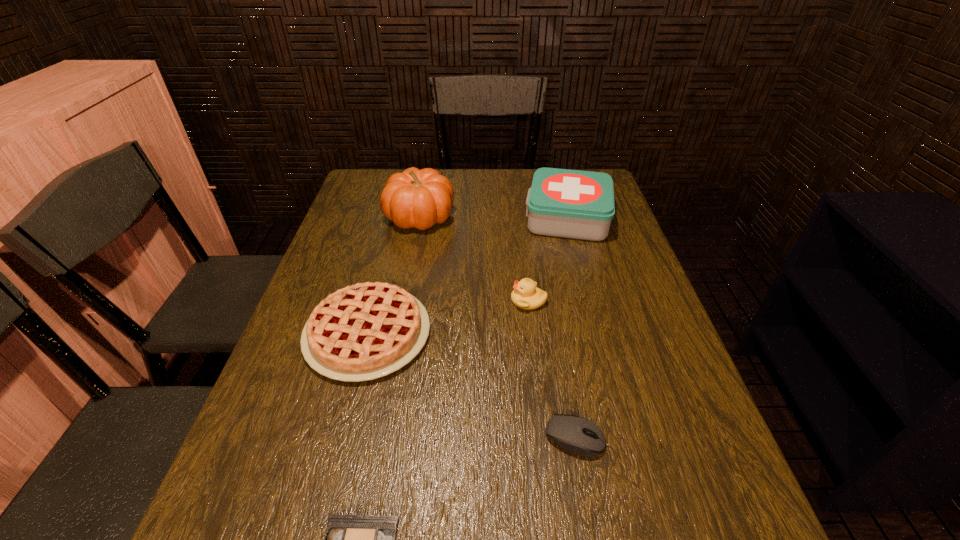
Find the location of `vacant area between the fourth shortest object and the third shortest object`. vacant area between the fourth shortest object and the third shortest object is located at coordinates (448, 317).

Select which object is the closest to the first-aid kit. Please provide its 2D coordinates. Your answer should be formatted as a tuple, i.e. [(x, y)], where the tuple contains the x and y coordinates of a point satisfying the conditions above.

[(526, 295)]

Identify which object is located as the second nearest to the tallest object. Please provide its 2D coordinates. Your answer should be formatted as a tuple, i.e. [(x, y)], where the tuple contains the x and y coordinates of a point satisfying the conditions above.

[(365, 331)]

Where is `vacant point that satisfies the following two spatial constraints: 1. on the back side of the second tallest object; 2. on the right side of the pie`? vacant point that satisfies the following two spatial constraints: 1. on the back side of the second tallest object; 2. on the right side of the pie is located at coordinates (397, 218).

Find the location of a particular element. free space that satisfies the following two spatial constraints: 1. on the back side of the fourth tallest object; 2. on the right side of the pumpkin is located at coordinates (397, 217).